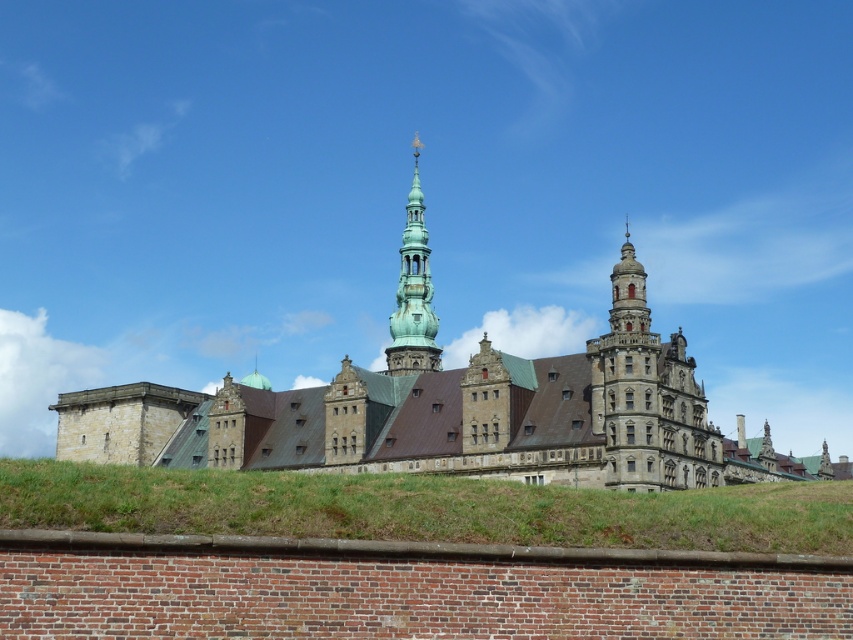
Looking at this image, is stone castle at center above green copper tower at center?

Incorrect, stone castle at center is not positioned above green copper tower at center.

Is stone castle at center bigger than green copper tower at center?

Yes, stone castle at center is bigger than green copper tower at center.

Describe the element at coordinates (451, 406) in the screenshot. I see `stone castle at center` at that location.

Identify the location of stone castle at center. (451, 406).

Can you confirm if stone castle at center is smaller than green grass at lower center?

Actually, stone castle at center might be larger than green grass at lower center.

Can you confirm if stone castle at center is taller than green grass at lower center?

Yes, stone castle at center is taller than green grass at lower center.

Identify the location of stone castle at center. (451, 406).

Can you confirm if green grass at lower center is positioned to the left of green copper tower at center?

Yes, green grass at lower center is to the left of green copper tower at center.

Can you confirm if green grass at lower center is thinner than green copper tower at center?

Incorrect, green grass at lower center's width is not less than green copper tower at center's.

Which is in front, point (225, 488) or point (410, 305)?

Point (225, 488) is in front.

Identify the location of green grass at lower center. (422, 508).